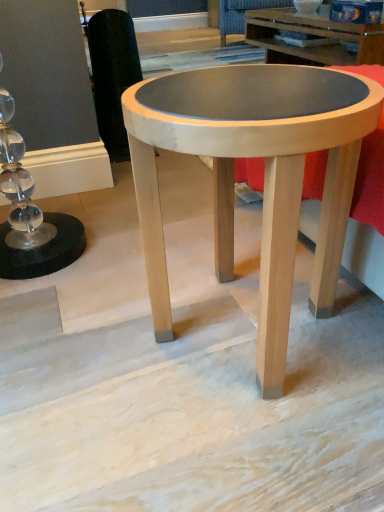
Question: From the image's perspective, is matte wood coffee table at center below black fabric swivel chair at left, the 2th swivel chair in the back-to-front sequence?

Choices:
 (A) yes
 (B) no

Answer: (A)

Question: Does matte wood coffee table at center have a smaller size compared to black fabric swivel chair at left, arranged as the 1th swivel chair when ordered from the bottom?

Choices:
 (A) yes
 (B) no

Answer: (B)

Question: Is matte wood coffee table at center bigger than black fabric swivel chair at left, arranged as the 1th swivel chair when ordered from the bottom?

Choices:
 (A) yes
 (B) no

Answer: (A)

Question: From the image's perspective, is matte wood coffee table at center on top of black fabric swivel chair at left, acting as the second swivel chair starting from the right?

Choices:
 (A) no
 (B) yes

Answer: (A)

Question: Is matte wood coffee table at center thinner than black fabric swivel chair at left, the 2th swivel chair in the back-to-front sequence?

Choices:
 (A) yes
 (B) no

Answer: (B)

Question: Can you confirm if matte wood coffee table at center is shorter than black fabric swivel chair at left, arranged as the 1th swivel chair when ordered from the bottom?

Choices:
 (A) yes
 (B) no

Answer: (A)

Question: Is black fabric swivel chair at left, which is the 1th swivel chair in left-to-right order, not near velvet dark blue swivel chair at upper center, the 1th swivel chair when ordered from top to bottom?

Choices:
 (A) yes
 (B) no

Answer: (A)

Question: From a real-world perspective, is black fabric swivel chair at left, the 2th swivel chair when ordered from top to bottom, physically above velvet dark blue swivel chair at upper center, acting as the second swivel chair starting from the bottom?

Choices:
 (A) no
 (B) yes

Answer: (B)

Question: From the image's perspective, is black fabric swivel chair at left, arranged as the 1th swivel chair when ordered from the bottom, on velvet dark blue swivel chair at upper center, the 1th swivel chair in the right-to-left sequence?

Choices:
 (A) yes
 (B) no

Answer: (B)

Question: Considering the relative sizes of black fabric swivel chair at left, the 2th swivel chair when ordered from top to bottom, and velvet dark blue swivel chair at upper center, acting as the second swivel chair starting from the bottom, in the image provided, is black fabric swivel chair at left, the 2th swivel chair when ordered from top to bottom, thinner than velvet dark blue swivel chair at upper center, acting as the second swivel chair starting from the bottom,?

Choices:
 (A) no
 (B) yes

Answer: (B)

Question: Is black fabric swivel chair at left, arranged as the 1th swivel chair when ordered from the bottom, outside of velvet dark blue swivel chair at upper center, which ranks as the second swivel chair in left-to-right order?

Choices:
 (A) no
 (B) yes

Answer: (B)

Question: Is the position of black fabric swivel chair at left, the 2th swivel chair in the back-to-front sequence, less distant than that of velvet dark blue swivel chair at upper center, which appears as the second swivel chair when viewed from the front?

Choices:
 (A) yes
 (B) no

Answer: (A)

Question: Is matte wood coffee table at center closer to the viewer compared to velvet dark blue swivel chair at upper center, which appears as the second swivel chair when viewed from the front?

Choices:
 (A) yes
 (B) no

Answer: (A)